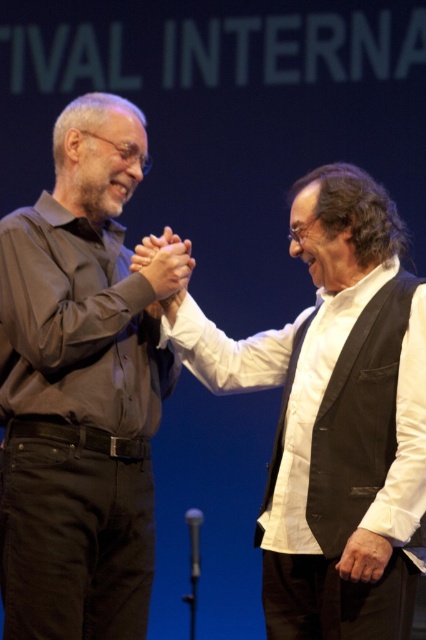
Question: Among these objects, which one is nearest to the camera?

Choices:
 (A) white shirt at center
 (B) matte black shirt at left
 (C) matte brown hands at center

Answer: (A)

Question: From the image, what is the correct spatial relationship of matte black shirt at left in relation to white shirt at center?

Choices:
 (A) right
 (B) left

Answer: (B)

Question: Observing the image, what is the correct spatial positioning of matte black shirt at left in reference to matte brown hands at center?

Choices:
 (A) right
 (B) left

Answer: (B)

Question: From the image, what is the correct spatial relationship of white shirt at center in relation to matte brown hands at center?

Choices:
 (A) below
 (B) above

Answer: (A)

Question: Which point is farther from the camera taking this photo?

Choices:
 (A) (422, 528)
 (B) (97, 477)
 (C) (143, 243)

Answer: (C)

Question: Which object is the farthest from the white shirt at center?

Choices:
 (A) matte black shirt at left
 (B) matte brown hands at center

Answer: (B)